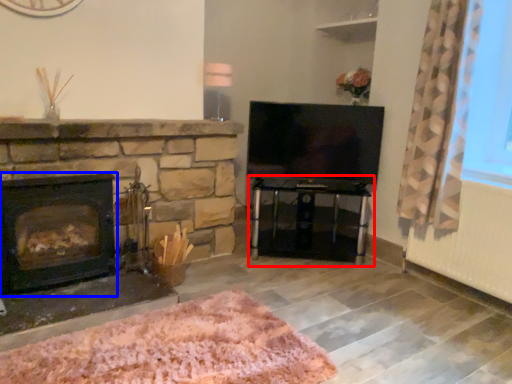
Question: Among these objects, which one is farthest to the camera, table (highlighted by a red box) or wood burning stove (highlighted by a blue box)?

Choices:
 (A) table
 (B) wood burning stove

Answer: (A)